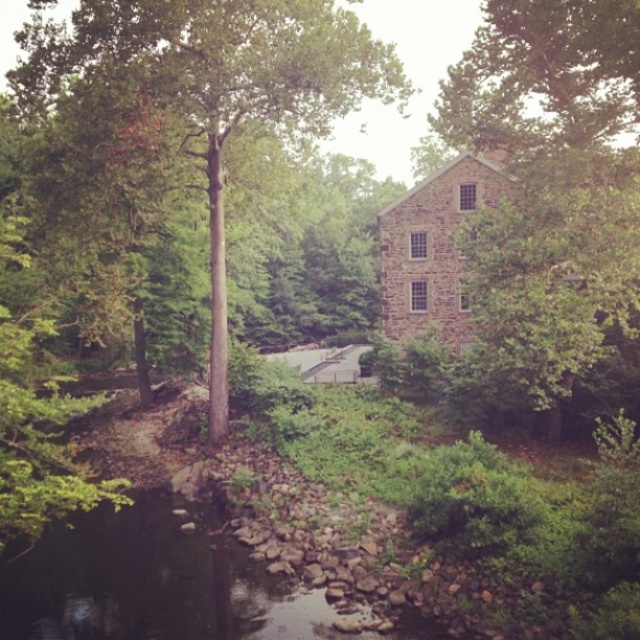
Question: Which point is closer to the camera taking this photo?

Choices:
 (A) (627, 227)
 (B) (148, 49)

Answer: (A)

Question: Does green leafy tree at upper right come in front of green rough bark tree at center?

Choices:
 (A) no
 (B) yes

Answer: (B)

Question: Which object is closer to the camera taking this photo?

Choices:
 (A) green leafy tree at upper right
 (B) green rough bark tree at center

Answer: (A)

Question: Is green leafy tree at upper right behind green rough bark tree at center?

Choices:
 (A) no
 (B) yes

Answer: (A)

Question: Is green leafy tree at upper right positioned in front of green rough bark tree at center?

Choices:
 (A) yes
 (B) no

Answer: (A)

Question: Which point is farther to the camera?

Choices:
 (A) (531, 195)
 (B) (220, 179)

Answer: (B)